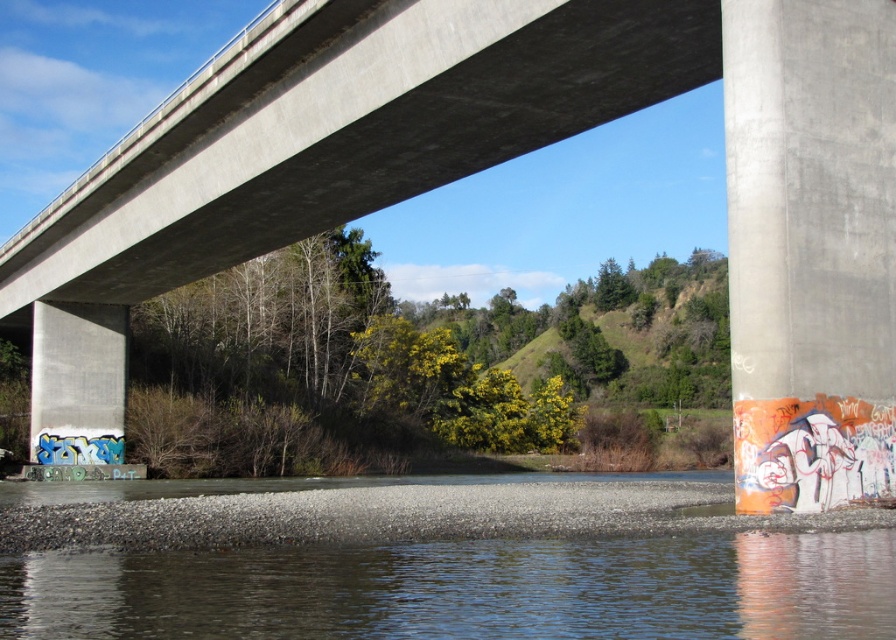
Based on the scene under a large concrete bridge, you are a construction worker assessing the height of the clear water at bottom and the concrete pillar at right. Which object is taller?

The concrete pillar at right is taller than the clear water at bottom.